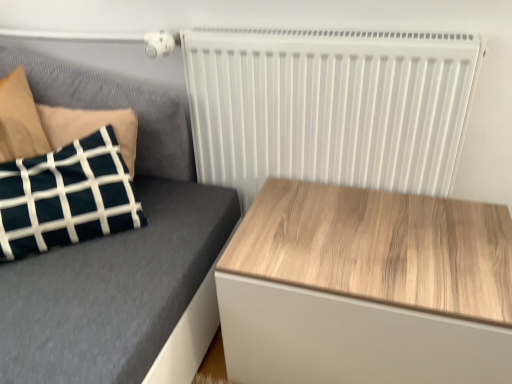
Question: In the image, is wooden table at right positioned in front of or behind velvet dark blue pillow at left?

Choices:
 (A) behind
 (B) front

Answer: (B)

Question: In terms of size, does wooden table at right appear bigger or smaller than velvet dark blue pillow at left?

Choices:
 (A) big
 (B) small

Answer: (A)

Question: Which object is positioned closest to the wooden table at right?

Choices:
 (A) velvet dark blue pillow at left
 (B) white matte radiator at upper right

Answer: (B)

Question: Based on their relative distances, which object is farther from the velvet dark blue pillow at left?

Choices:
 (A) wooden table at right
 (B) white matte radiator at upper right

Answer: (A)